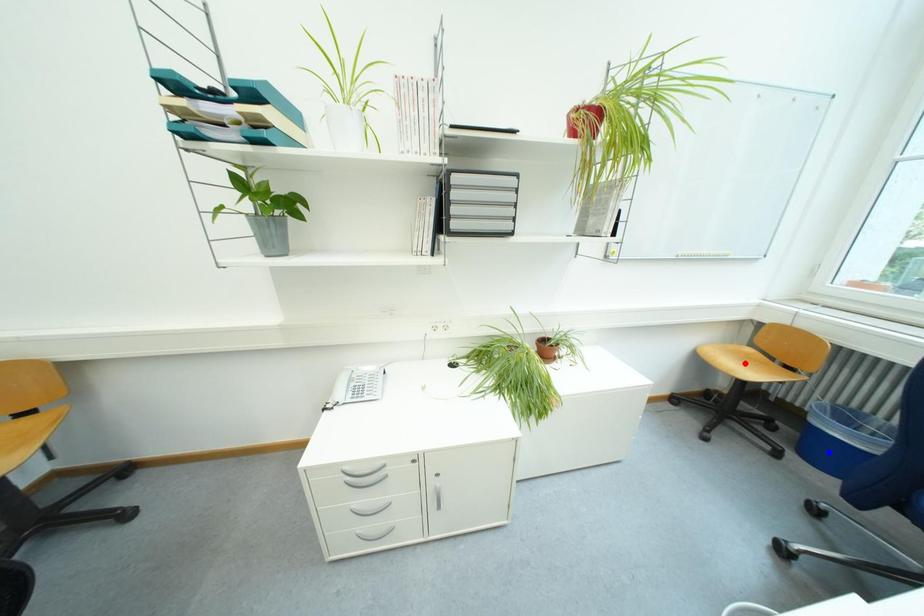
Question: Two points are marked on the image. Which point is closer to the camera?

Choices:
 (A) Blue point is closer.
 (B) Red point is closer.

Answer: (A)